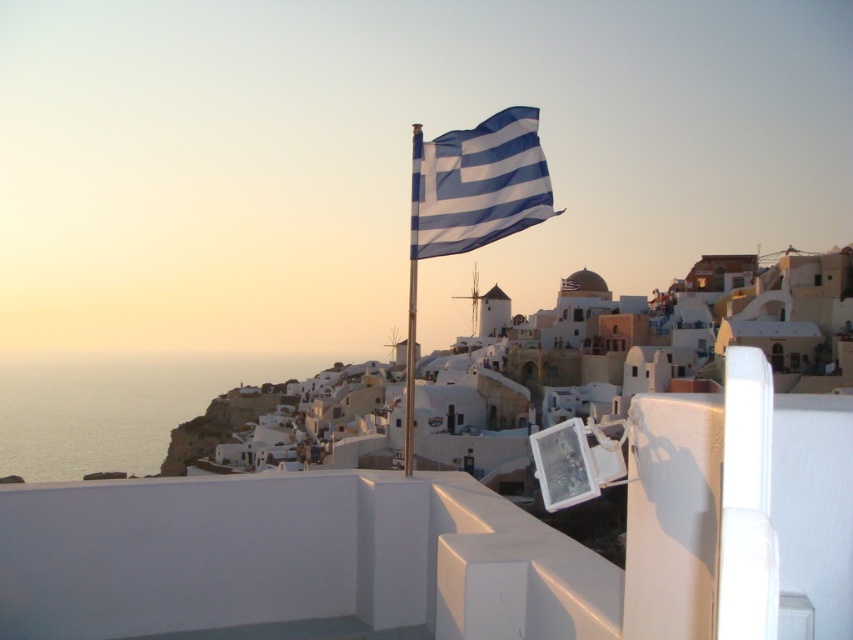
You are a tourist visiting the coastal town and want to take a photo that includes both the white matte building at center and the blue and white striped flag at center. Which object should you position closer to the camera to ensure both fit in the frame?

Since the white matte building at center is larger than the blue and white striped flag at center, you should position the blue and white striped flag at center closer to the camera to ensure both fit in the frame.

You are a tourist standing in front of the white matte building at center and the metallic silver flag pole at center. Which object is positioned to the right side?

The white matte building at center is to the right of the metallic silver flag pole at center, so the white matte building at center is positioned to the right side.